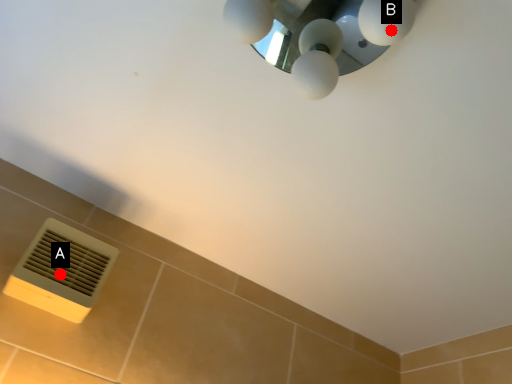
Question: Two points are circled on the image, labeled by A and B beside each circle. Among these points, which one is farthest from the camera?

Choices:
 (A) A is further
 (B) B is further

Answer: (A)